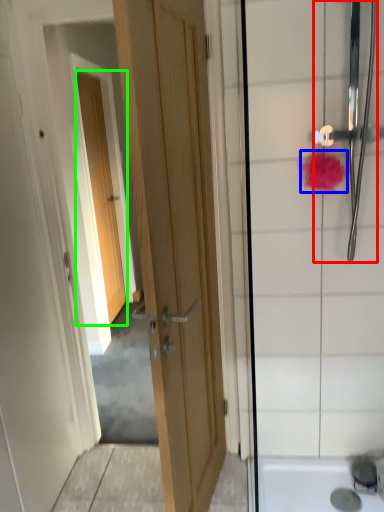
Question: Which object is positioned farthest from shower (highlighted by a red box)? Select from flower (highlighted by a blue box) and door (highlighted by a green box).

Choices:
 (A) flower
 (B) door

Answer: (B)